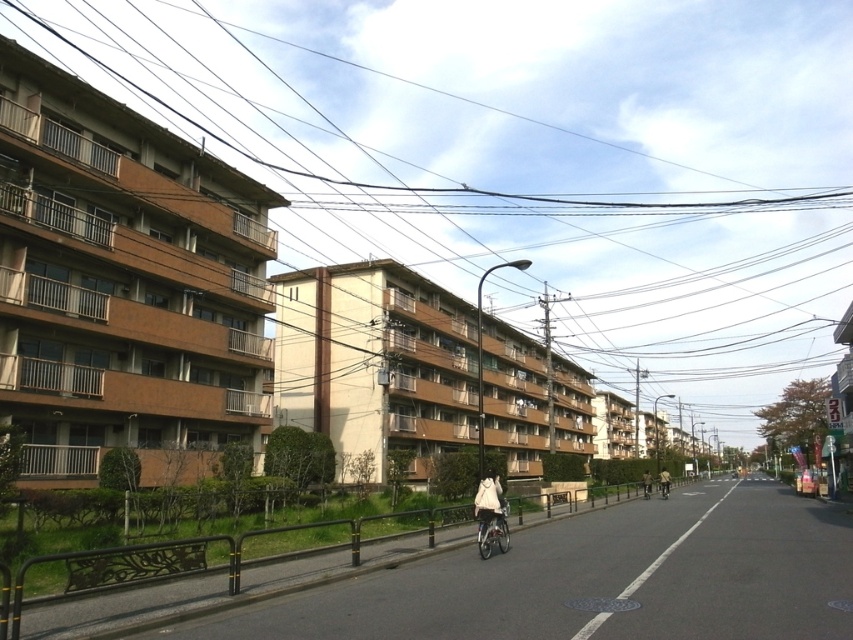
Can you confirm if metallic silver bicycle at center is taller than khaki fabric jacket at center?

No.

Which is in front, point (502, 534) or point (665, 488)?

Point (502, 534) is more forward.

Measure the distance between point (503, 531) and camera.

Point (503, 531) is 14.50 meters from camera.

In order to click on metallic silver bicycle at center in this screenshot , I will do `click(492, 529)`.

Between brown wire at upper center and matte black bicycle at center-right, which one has less height?

With less height is matte black bicycle at center-right.

Can you confirm if brown wire at upper center is wider than matte black bicycle at center-right?

Yes, brown wire at upper center is wider than matte black bicycle at center-right.

Describe the element at coordinates (532, 160) in the screenshot. I see `brown wire at upper center` at that location.

What are the coordinates of `brown wire at upper center` in the screenshot? It's located at (532, 160).

Who is positioned more to the left, brown wire at upper center or white matte jacket at center?

From the viewer's perspective, brown wire at upper center appears more on the left side.

Does point (680, 253) come closer to viewer compared to point (494, 529)?

No.

Who is more distant from viewer, (714, 152) or (491, 529)?

The point (714, 152) is more distant.

Find the location of `brown wire at upper center`. brown wire at upper center is located at coordinates (532, 160).